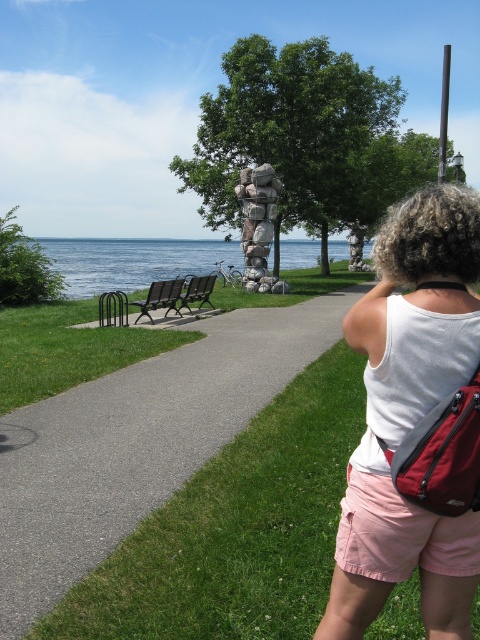
Can you confirm if gray asphalt path at center is positioned to the left of white fabric tank top at upper right?

Correct, you'll find gray asphalt path at center to the left of white fabric tank top at upper right.

Does gray asphalt path at center have a greater height compared to white fabric tank top at upper right?

Yes.

The height and width of the screenshot is (640, 480). I want to click on gray asphalt path at center, so click(x=136, y=442).

Image resolution: width=480 pixels, height=640 pixels. What are the coordinates of `gray asphalt path at center` in the screenshot? It's located at (136, 442).

Is white fabric tank top at upper right smaller than blue water at center?

Indeed, white fabric tank top at upper right has a smaller size compared to blue water at center.

Measure the distance between point (415, 230) and camera.

Point (415, 230) is 6.42 feet from camera.

Does point (479, 563) lie behind point (160, 257)?

No.

The height and width of the screenshot is (640, 480). What are the coordinates of `white fabric tank top at upper right` in the screenshot? It's located at (409, 417).

Is point (363, 476) in front of point (175, 243)?

Yes.

Identify the location of pink cotton shorts at lower right. The image size is (480, 640). (400, 532).

Is point (417, 554) farther from camera compared to point (106, 246)?

No.

Find the location of a particular element. This screenshot has height=640, width=480. pink cotton shorts at lower right is located at coordinates (400, 532).